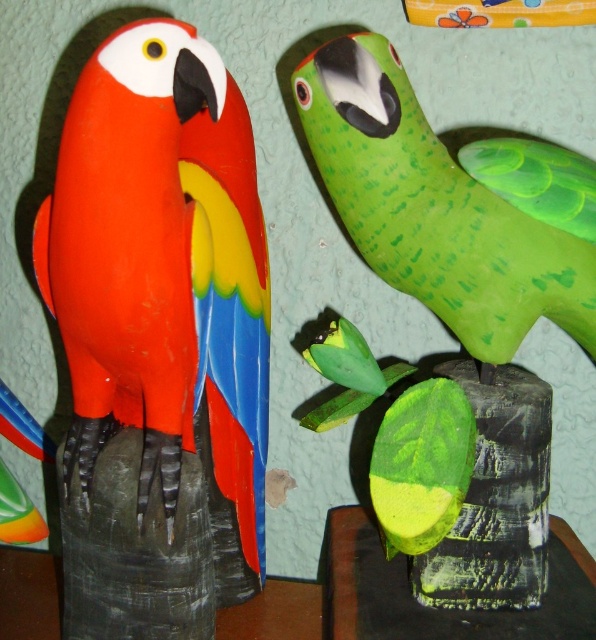
You are an interior designer planning to place a new decorative item in the space between the two parrot sculptures. The coordinates of the point where you want to place it are given as point (163, 256). Based on the scene description, which parrot sculpture is located at this specific coordinate point?

The point (163, 256) corresponds to the location of the matte plastic parrot at left.

You are an interior designer assessing the placement of the matte plastic parrot at left and the green matte parrot at upper right on a wall. Which parrot should you choose if you want to place a smaller sculpture on the wall?

The green matte parrot at upper right is smaller in size than the matte plastic parrot at left, so you should choose the green matte parrot at upper right for a smaller sculpture placement.

You are an art installer who needs to move the matte plastic parrot at left and the green matte parrot at upper right to a new display area. If you want to keep their original left to right arrangement, which parrot should you place first on the new display area?

You should place the matte plastic parrot at left first on the new display area because it is originally positioned to the left of the green matte parrot at upper right, so placing it first maintains the left to right order.